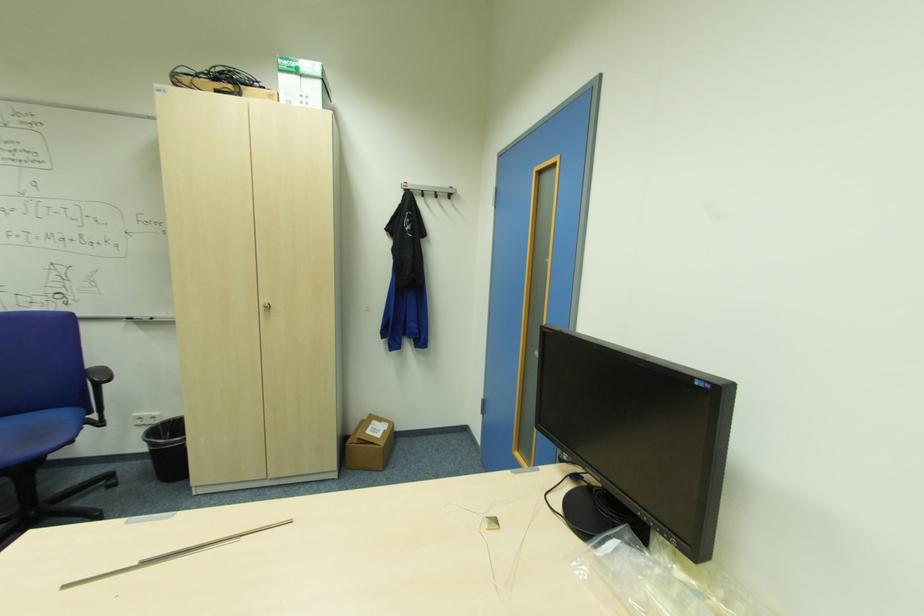
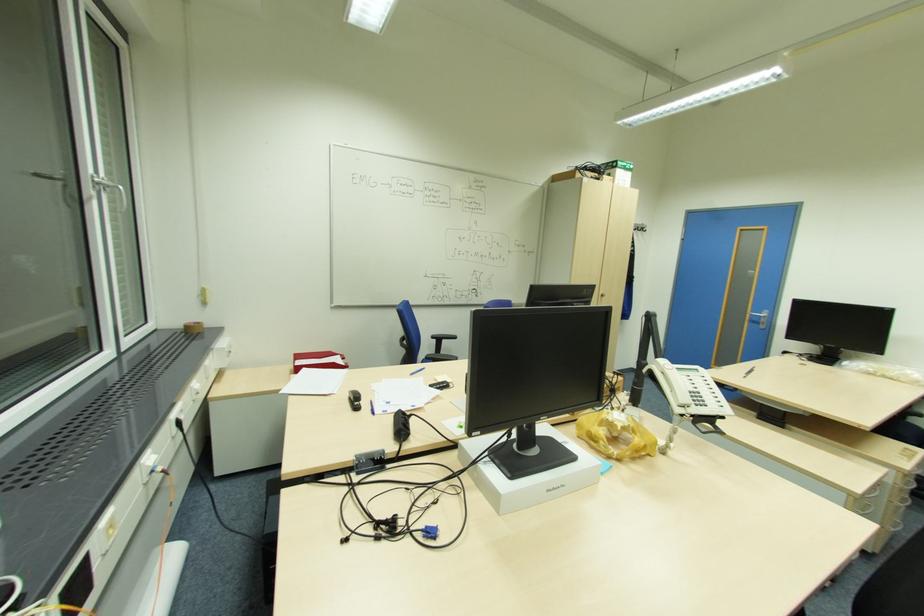
In the second image, find the point that corresponds to (x=271, y=307) in the first image.

(604, 294)